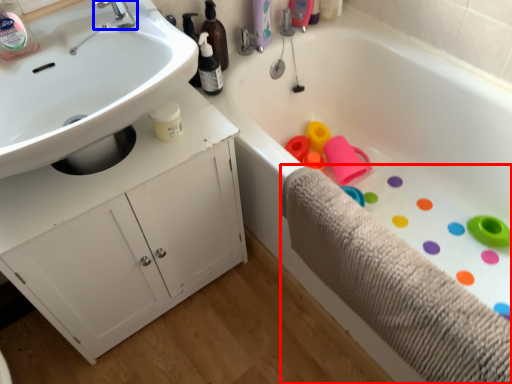
Question: Which object is further to the camera taking this photo, bath towel (highlighted by a red box) or tap (highlighted by a blue box)?

Choices:
 (A) bath towel
 (B) tap

Answer: (B)